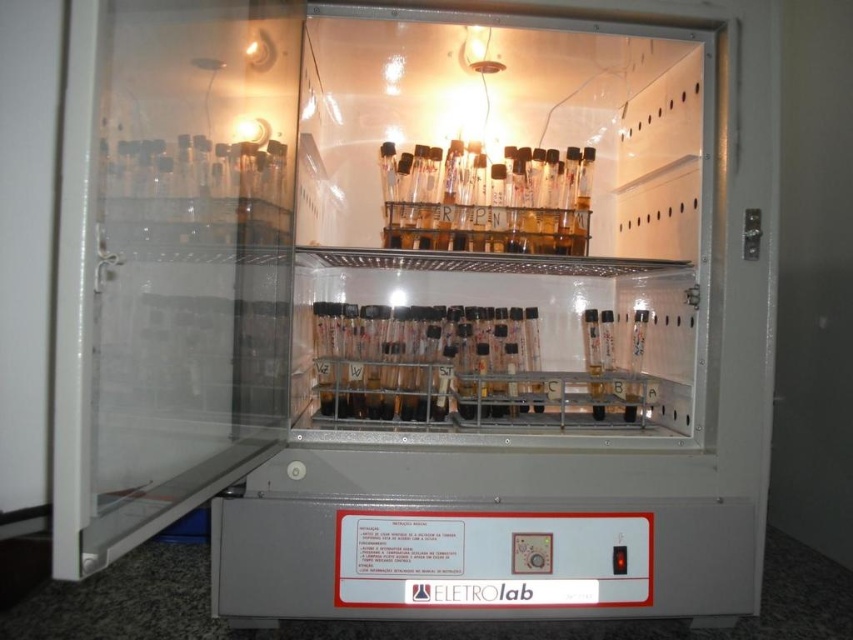
Question: Which point appears closest to the camera in this image?

Choices:
 (A) (424, 330)
 (B) (434, 202)

Answer: (A)

Question: Is clear plastic tubes at center positioned at the back of transparent glass test tube at center?

Choices:
 (A) yes
 (B) no

Answer: (B)

Question: Which of the following is the farthest from the observer?

Choices:
 (A) clear plastic tubes at center
 (B) transparent glass test tube at center

Answer: (B)

Question: Can you confirm if clear plastic tubes at center is positioned above transparent glass test tube at center?

Choices:
 (A) no
 (B) yes

Answer: (A)

Question: Is clear plastic tubes at center closer to camera compared to transparent glass test tube at center?

Choices:
 (A) yes
 (B) no

Answer: (A)